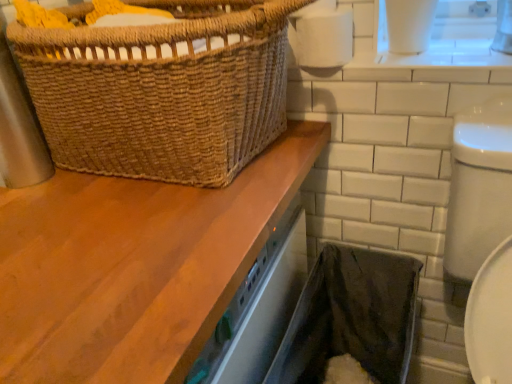
The height and width of the screenshot is (384, 512). Find the location of `vacant space situated above wooden countertop at upper left (from a real-world perspective)`. vacant space situated above wooden countertop at upper left (from a real-world perspective) is located at coordinates (119, 215).